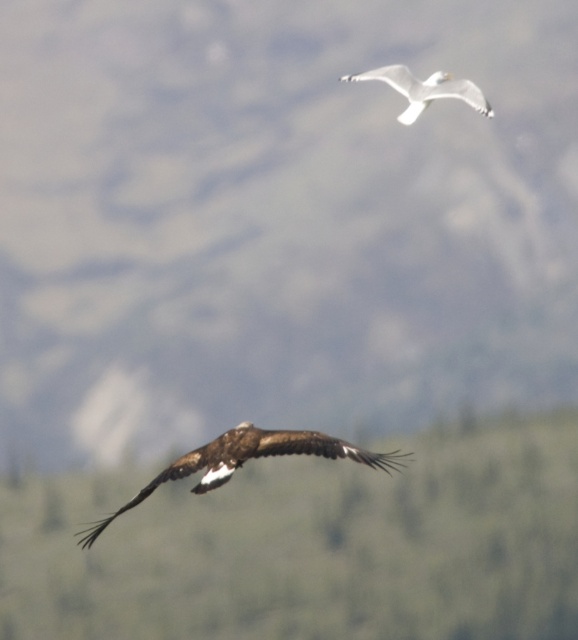
You are a photographer standing at the scene. You want to capture a photo of the brown textured tree at lower center. What is the approximate distance you need to set your camera lens to focus on the tree?

The brown textured tree at lower center is approximately 45.31 meters away from the viewer, so you should set your camera lens to focus at around 45.31 meters to capture it clearly.

You are a photographer trying to capture a photo of the brown feathered eagle at center. You notice there is a brown textured tree at lower center in your shot. Based on their positions, will the tree block your view of the eagle?

The brown textured tree at lower center is positioned on the left side of the brown feathered eagle at center, so it will not block your view of the eagle since it is to the side rather than directly in front.

You are a nature photographer trying to capture both the brown feathered eagle at center and the white matte bird at upper center in your shot. Based on their sizes in the image, which bird would appear larger in your photograph?

The brown feathered eagle at center appears larger in the photograph because it has a greater height compared to the white matte bird at upper center.